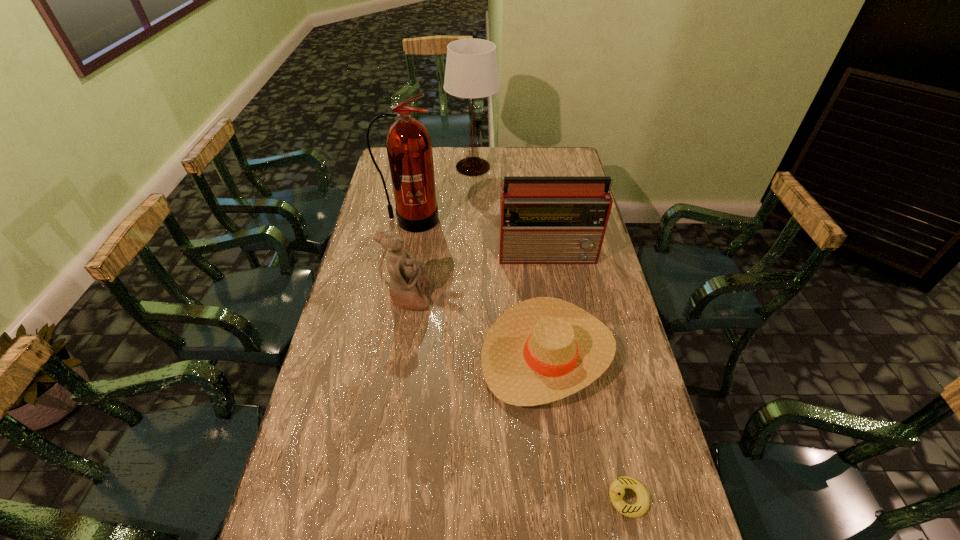
This screenshot has width=960, height=540. In order to click on the farthest object in this screenshot , I will do pyautogui.click(x=471, y=71).

Locate an element on the screen. the fifth nearest object is located at coordinates (409, 147).

Find the location of a particular element. The height and width of the screenshot is (540, 960). radio receiver is located at coordinates (543, 219).

Identify the location of figurine. (408, 279).

The height and width of the screenshot is (540, 960). Identify the location of sunhat. (543, 349).

The width and height of the screenshot is (960, 540). I want to click on the shortest object, so click(x=616, y=492).

Locate an element on the screen. the nearest object is located at coordinates (616, 492).

What are the coordinates of `vacant space situated above the cylindrical shade of the farthest object` in the screenshot? It's located at coord(569,167).

Locate an element on the screen. This screenshot has height=540, width=960. free space located on the front-facing side of the fire extinguisher is located at coordinates (397, 287).

Find the location of a particular element. The image size is (960, 540). blank space located 0.110m on the front-facing side of the fourth nearest object is located at coordinates (555, 289).